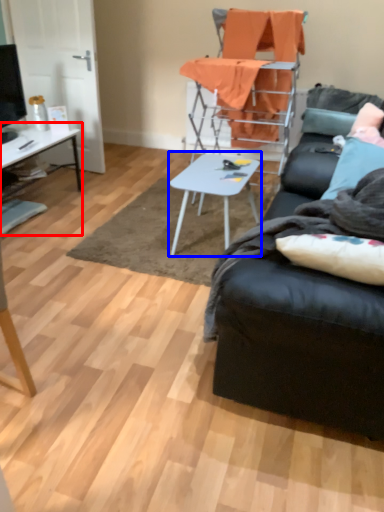
Question: Which point is further to the camera, desk (highlighted by a red box) or table (highlighted by a blue box)?

Choices:
 (A) desk
 (B) table

Answer: (A)